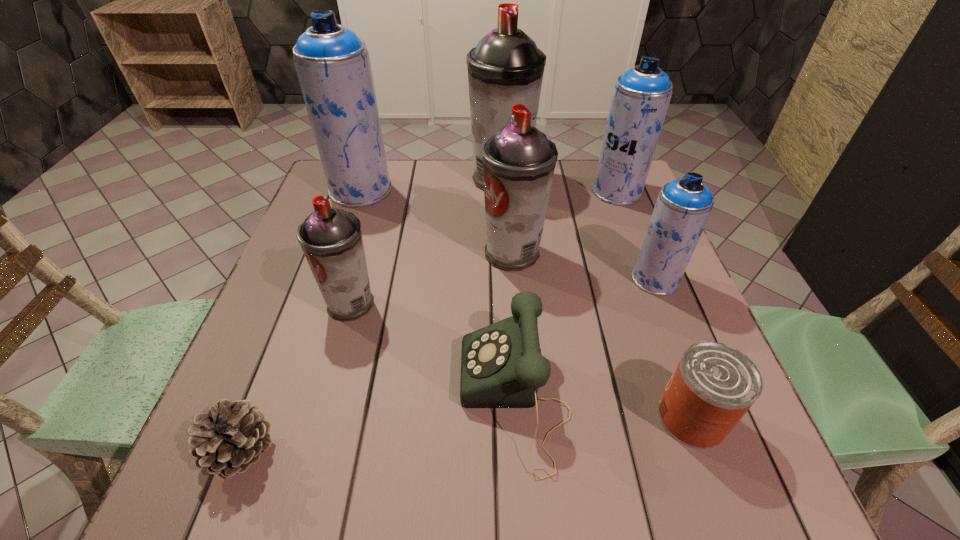
Where is `vacant space that satisfies the following two spatial constraints: 1. on the front side of the can; 2. on the left side of the smallest gray aerosol can`? The height and width of the screenshot is (540, 960). vacant space that satisfies the following two spatial constraints: 1. on the front side of the can; 2. on the left side of the smallest gray aerosol can is located at coordinates (320, 417).

I want to click on vacant area that satisfies the following two spatial constraints: 1. on the back side of the shortest object; 2. on the left side of the second nearest gray aerosol can, so click(318, 253).

You are a GUI agent. You are given a task and a screenshot of the screen. Output one action in this format:
    pyautogui.click(x=<x>, y=<y>)
    Task: Click on the vacant space that satisfies the following two spatial constraints: 1. on the back side of the biggest blue aerosol can; 2. on the left side of the shortest object
    The height and width of the screenshot is (540, 960).
    Given the screenshot: What is the action you would take?
    pyautogui.click(x=342, y=190)

The width and height of the screenshot is (960, 540). I want to click on free space that satisfies the following two spatial constraints: 1. on the dial of the telephone; 2. on the left side of the can, so click(516, 417).